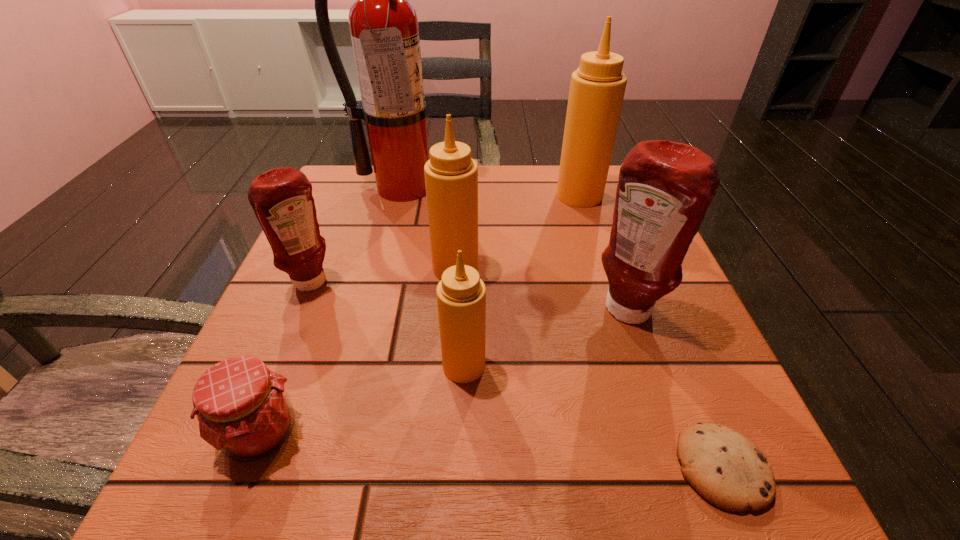
Image resolution: width=960 pixels, height=540 pixels. In order to click on the tallest object in this screenshot , I will do `click(383, 24)`.

The image size is (960, 540). In order to click on fire extinguisher in this screenshot , I will do `click(383, 24)`.

The image size is (960, 540). In order to click on the farthest condiment in this screenshot , I will do `click(597, 88)`.

At what (x,y) coordinates should I click in order to perform the action: click on the seventh shortest object. Please return your answer as a coordinate pair (x, y). Image resolution: width=960 pixels, height=540 pixels. Looking at the image, I should click on (597, 88).

Locate an element on the screen. This screenshot has height=540, width=960. the right red condiment is located at coordinates pyautogui.click(x=664, y=189).

Locate an element on the screen. Image resolution: width=960 pixels, height=540 pixels. the second biggest tan condiment is located at coordinates (451, 176).

This screenshot has width=960, height=540. Find the location of `the smaller red condiment`. the smaller red condiment is located at coordinates (281, 198).

At what (x,y) coordinates should I click in order to perform the action: click on the leftmost condiment. Please return your answer as a coordinate pair (x, y). The height and width of the screenshot is (540, 960). Looking at the image, I should click on (281, 198).

You are a GUI agent. You are given a task and a screenshot of the screen. Output one action in this format:
    pyautogui.click(x=<x>, y=<y>)
    Task: Click on the nearest condiment
    
    Given the screenshot: What is the action you would take?
    pyautogui.click(x=461, y=295)

I want to click on the smallest tan condiment, so click(461, 295).